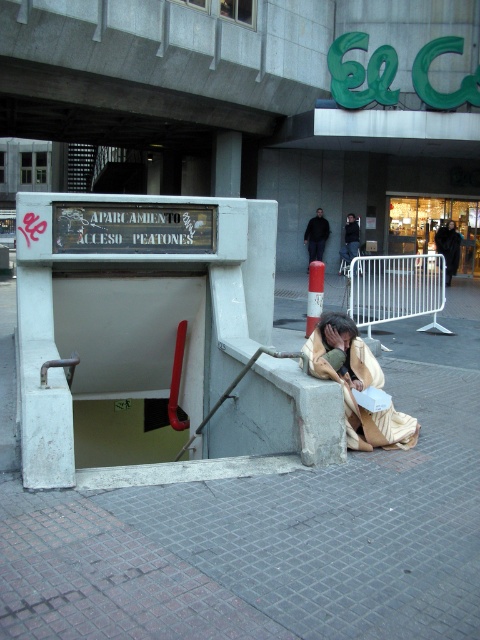
You are a delivery person trying to locate a person sitting on a concrete ledge near the pedestrian entrance of the parking garage. The coordinates given are point (357,385). What object is located at this point?

The point (357,385) corresponds to the beige fabric blanket at lower center.

From the picture: You are a passerby who notices a person sitting on the ledge near the parking garage entrance. You want to approach them to offer help but need to ensure you can reach them without obstacles. The person is wearing dark blue jeans at center and dark brown leather jacket at center. Which piece of clothing is closer to the entrance so you can approach from that side?

The dark blue jeans at center is positioned on the left side of dark brown leather jacket at center, so the dark blue jeans at center is closer to the entrance. Approach from the left side where the dark blue jeans at center is located.